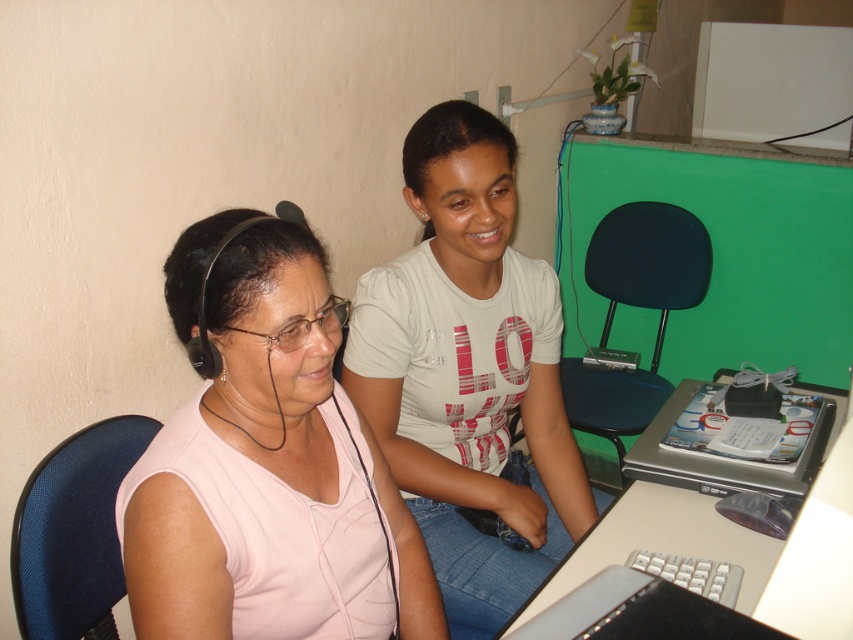
Is white cotton shirt at center wider than white plastic table at lower right?

Indeed, white cotton shirt at center has a greater width compared to white plastic table at lower right.

The image size is (853, 640). Describe the element at coordinates (468, 369) in the screenshot. I see `white cotton shirt at center` at that location.

Locate an element on the screen. The image size is (853, 640). white cotton shirt at center is located at coordinates (468, 369).

Is point (157, 572) positioned after point (393, 422)?

That is False.

Does pink matte tank top at center have a lesser width compared to white cotton shirt at center?

Yes, pink matte tank top at center is thinner than white cotton shirt at center.

Which is in front, point (271, 499) or point (426, 180)?

Positioned in front is point (271, 499).

This screenshot has height=640, width=853. I want to click on pink matte tank top at center, so click(267, 460).

Who is more forward, (233, 467) or (811, 410)?

Positioned in front is point (233, 467).

From the picture: Which is above, pink matte tank top at center or silver/black plastic laptop at lower right?

silver/black plastic laptop at lower right

Image resolution: width=853 pixels, height=640 pixels. Find the location of `pink matte tank top at center`. pink matte tank top at center is located at coordinates (267, 460).